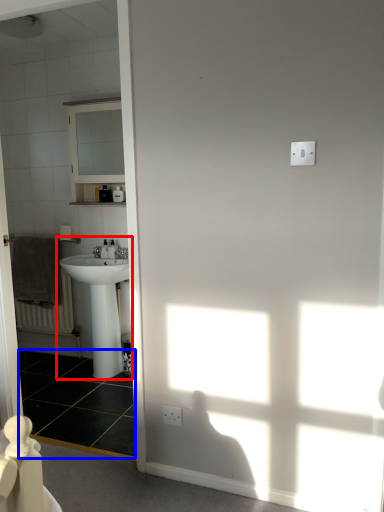
Question: Which object appears closest to the camera in this image, sink (highlighted by a red box) or tile (highlighted by a blue box)?

Choices:
 (A) sink
 (B) tile

Answer: (B)